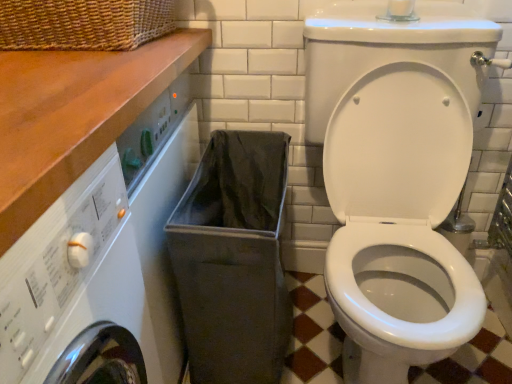
Question: Is white glossy toilet at center taller or shorter than gray fabric laundry basket at lower center?

Choices:
 (A) tall
 (B) short

Answer: (A)

Question: Is white glossy toilet at center inside or outside of gray fabric laundry basket at lower center?

Choices:
 (A) outside
 (B) inside

Answer: (A)

Question: Which object is the farthest from the wooden at upper left?

Choices:
 (A) gray fabric laundry basket at lower center
 (B) white glossy toilet at center

Answer: (B)

Question: Which object is positioned farthest from the wooden at upper left?

Choices:
 (A) white glossy toilet at center
 (B) gray fabric laundry basket at lower center

Answer: (A)